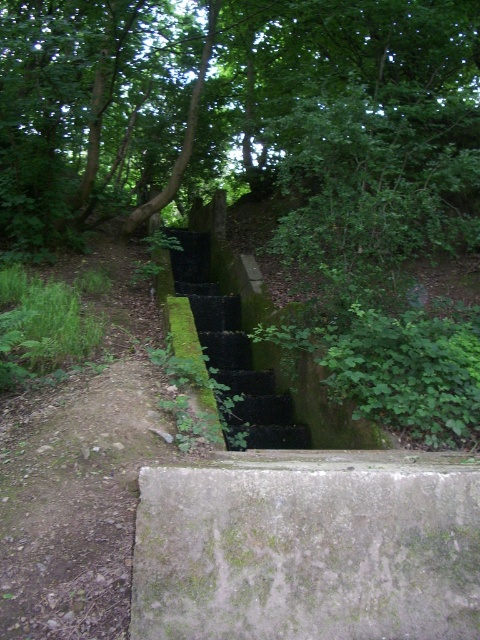
Question: Considering the relative positions of green leafy tree at upper center and green mossy concrete at center in the image provided, where is green leafy tree at upper center located with respect to green mossy concrete at center?

Choices:
 (A) left
 (B) right

Answer: (A)

Question: Which point is farther to the camera?

Choices:
 (A) green leafy tree at upper center
 (B) green mossy concrete at center

Answer: (A)

Question: Can you confirm if green leafy tree at upper center is thinner than green mossy concrete at center?

Choices:
 (A) no
 (B) yes

Answer: (A)

Question: Is green leafy tree at upper center below green mossy concrete at center?

Choices:
 (A) no
 (B) yes

Answer: (A)